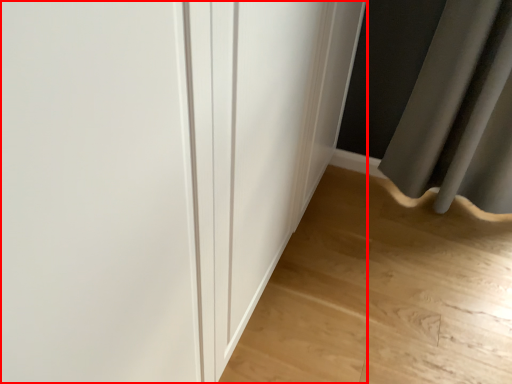
Question: Where is door (annotated by the red box) located in relation to corridor in the image?

Choices:
 (A) left
 (B) right

Answer: (A)